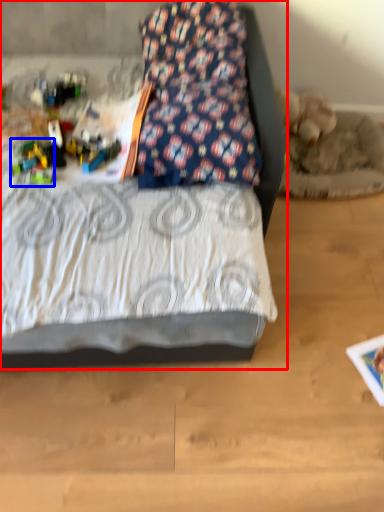
Question: Which object is further to the camera taking this photo, bed (highlighted by a red box) or toy (highlighted by a blue box)?

Choices:
 (A) bed
 (B) toy

Answer: (B)